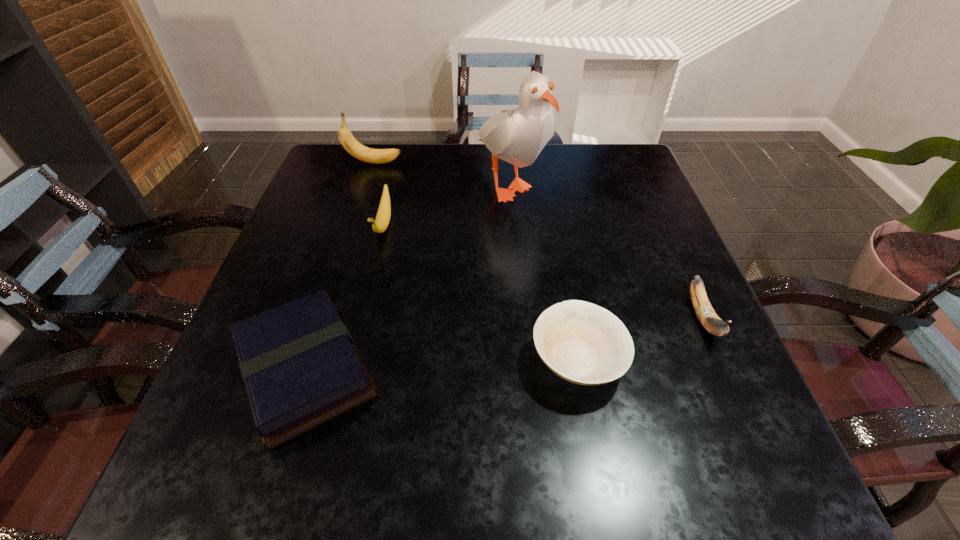
The height and width of the screenshot is (540, 960). Identify the location of the tallest object. (517, 135).

Identify the location of the second tallest object. (376, 156).

I want to click on the tallest banana, so click(376, 156).

Identify the location of the second farthest banana. The height and width of the screenshot is (540, 960). (380, 224).

At what (x,y) coordinates should I click in order to perform the action: click on the rightmost banana. Please return your answer as a coordinate pair (x, y). Image resolution: width=960 pixels, height=540 pixels. Looking at the image, I should click on (709, 319).

Find the location of a particular element. The height and width of the screenshot is (540, 960). the rightmost object is located at coordinates (709, 319).

This screenshot has height=540, width=960. I want to click on bowl, so click(583, 343).

You are a GUI agent. You are given a task and a screenshot of the screen. Output one action in this format:
    pyautogui.click(x=<x>, y=<y>)
    Task: Click on the book
    
    Given the screenshot: What is the action you would take?
    pyautogui.click(x=300, y=367)

Find the location of a particular element. Image resolution: width=960 pixels, height=540 pixels. vacant point located at the beak of the tallest object is located at coordinates (516, 288).

Locate an element on the screen. free space located 0.310m at the start of the peel on the tallest banana is located at coordinates (515, 163).